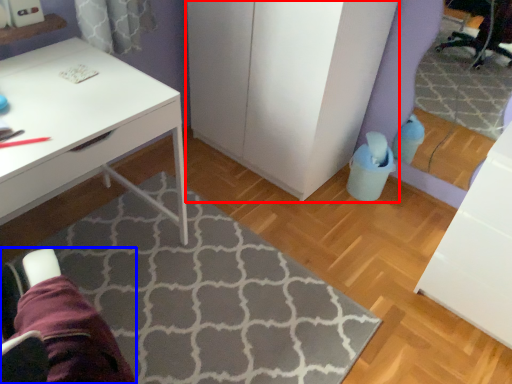
Question: Which point is further to the camera, dresser (highlighted by a red box) or swivel chair (highlighted by a blue box)?

Choices:
 (A) dresser
 (B) swivel chair

Answer: (A)